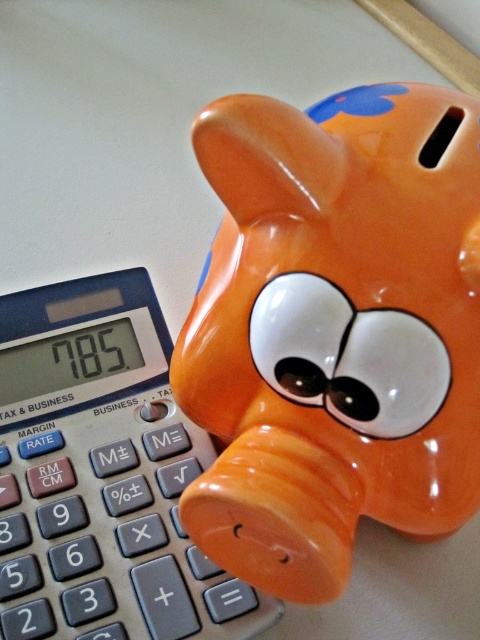
Question: Which object is closer to the camera taking this photo?

Choices:
 (A) orange glossy piggy bank at upper right
 (B) blue plastic calculator at center-left
 (C) white glossy eye at center

Answer: (A)

Question: Can you confirm if blue plastic calculator at center-left is bigger than white glossy eye at center?

Choices:
 (A) no
 (B) yes

Answer: (B)

Question: Does orange glossy piggy bank at upper right come in front of blue plastic calculator at center-left?

Choices:
 (A) yes
 (B) no

Answer: (A)

Question: Which point is closer to the camera taking this photo?

Choices:
 (A) (240, 557)
 (B) (373, 369)
 (C) (6, 442)

Answer: (B)

Question: Among these objects, which one is nearest to the camera?

Choices:
 (A) white glossy eye at center
 (B) blue plastic calculator at center-left
 (C) orange glossy piggy bank at upper right

Answer: (C)

Question: Does blue plastic calculator at center-left have a lesser width compared to white glossy eye at center?

Choices:
 (A) no
 (B) yes

Answer: (A)